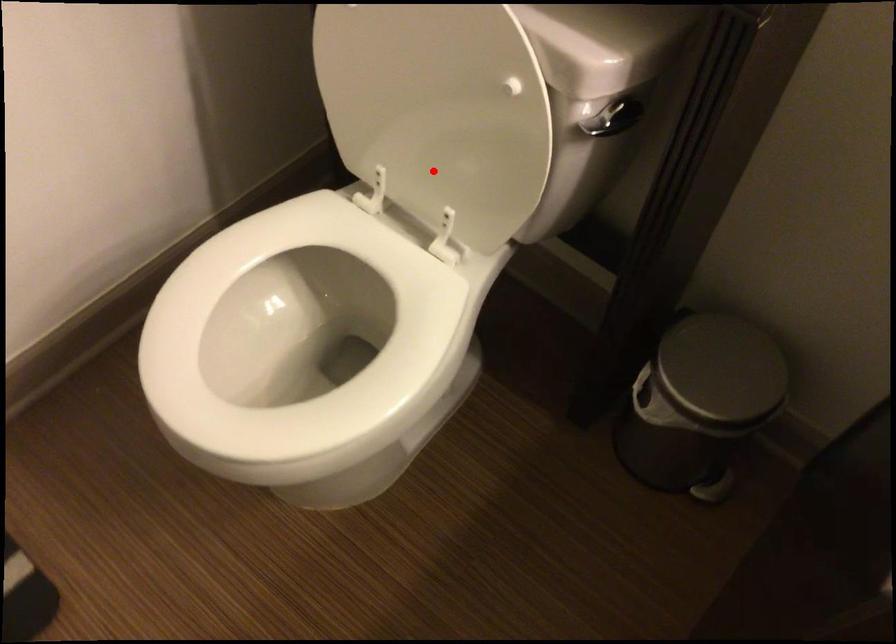
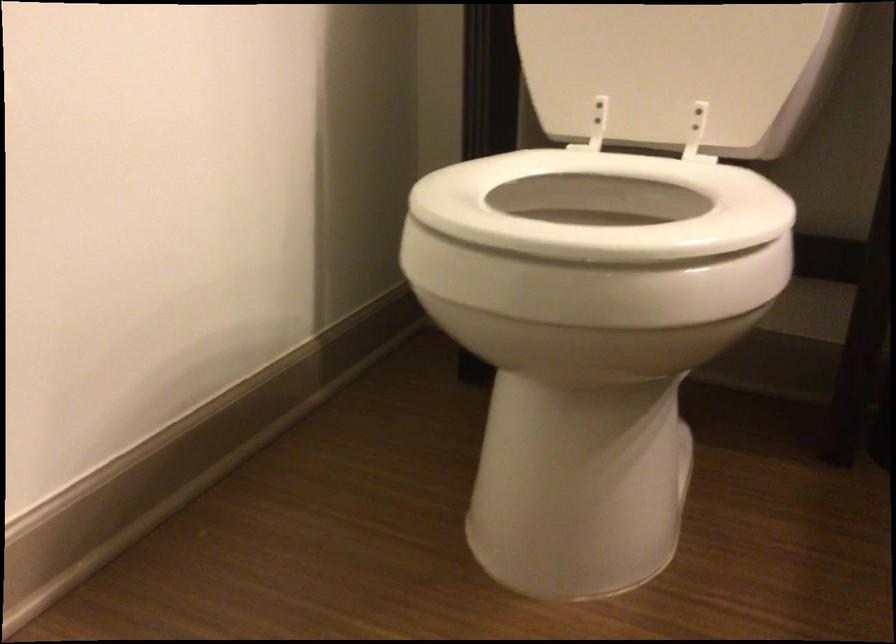
Where in the second image is the point corresponding to the highlighted location from the first image?

(677, 71)